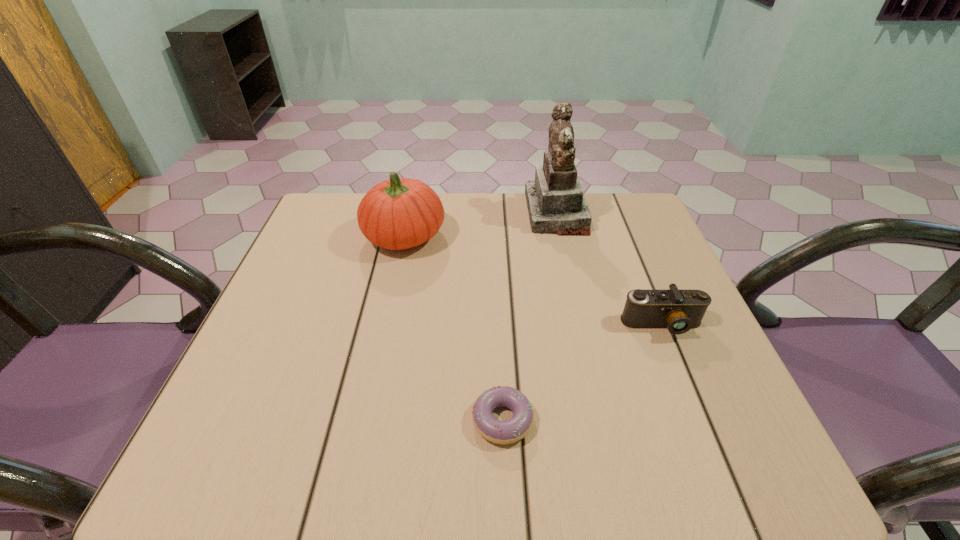
This screenshot has width=960, height=540. Identify the location of the tallest object. (556, 205).

I want to click on the second object from right to left, so click(556, 205).

You are a GUI agent. You are given a task and a screenshot of the screen. Output one action in this format:
    pyautogui.click(x=<x>, y=<y>)
    Task: Click on the leftmost object
    This screenshot has width=960, height=540.
    Given the screenshot: What is the action you would take?
    pyautogui.click(x=398, y=213)

Find the location of a particular element. the third shortest object is located at coordinates (398, 213).

The image size is (960, 540). Find the location of `the rightmost object`. the rightmost object is located at coordinates (677, 310).

The width and height of the screenshot is (960, 540). Identify the location of the third tallest object. (677, 310).

I want to click on the shortest object, so click(x=500, y=432).

Find the location of a particular element. Image resolution: width=960 pixels, height=540 pixels. doughnut is located at coordinates (500, 432).

Identify the location of vacant space situated 0.320m on the front-facing side of the tallest object. This screenshot has height=540, width=960. (412, 213).

In order to click on vacant space situated 0.090m on the front-facing side of the tallest object in this screenshot , I will do `click(494, 213)`.